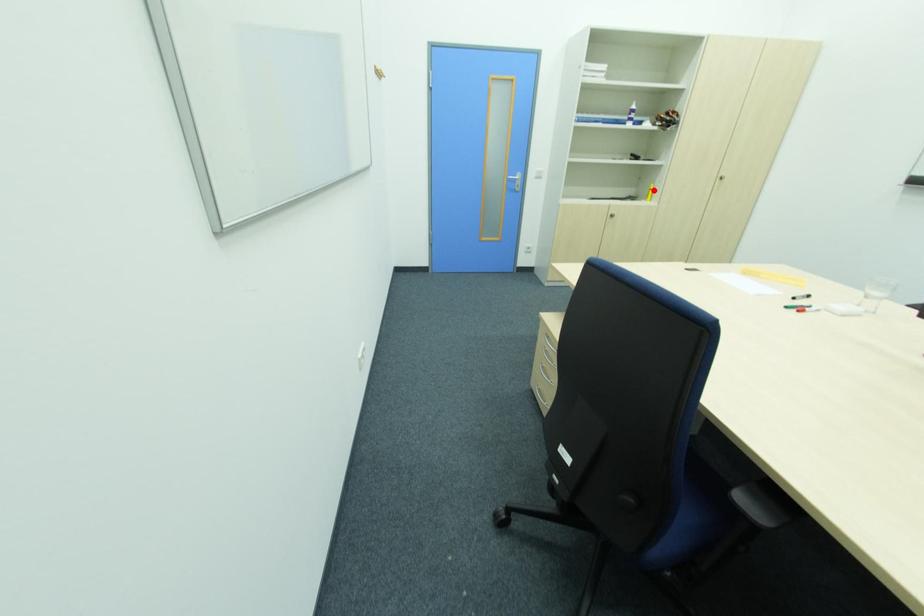
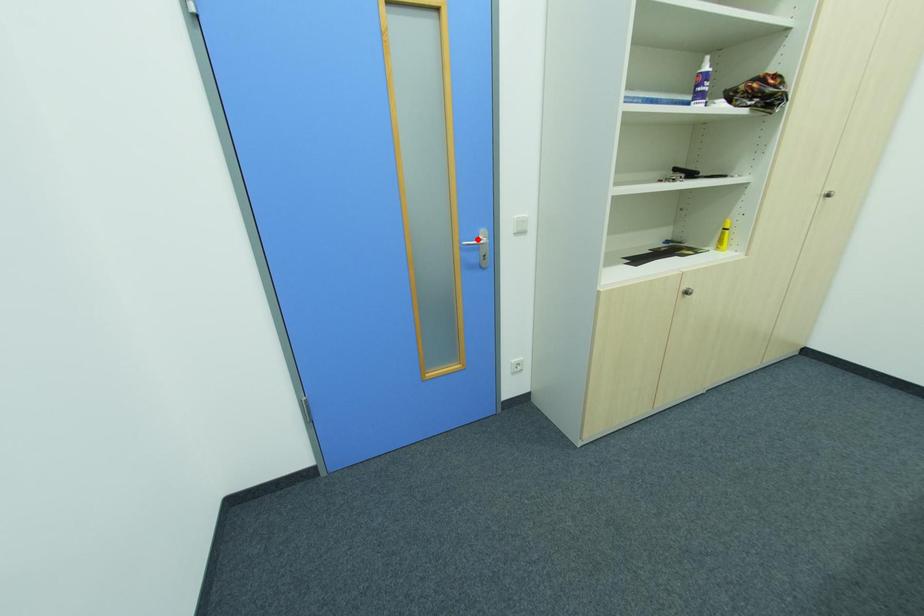
I am providing you with two images of the same scene from different viewpoints. A red point is marked on the first image and another point is marked on the second image. Is the marked point in image1 the same physical position as the marked point in image2?

No